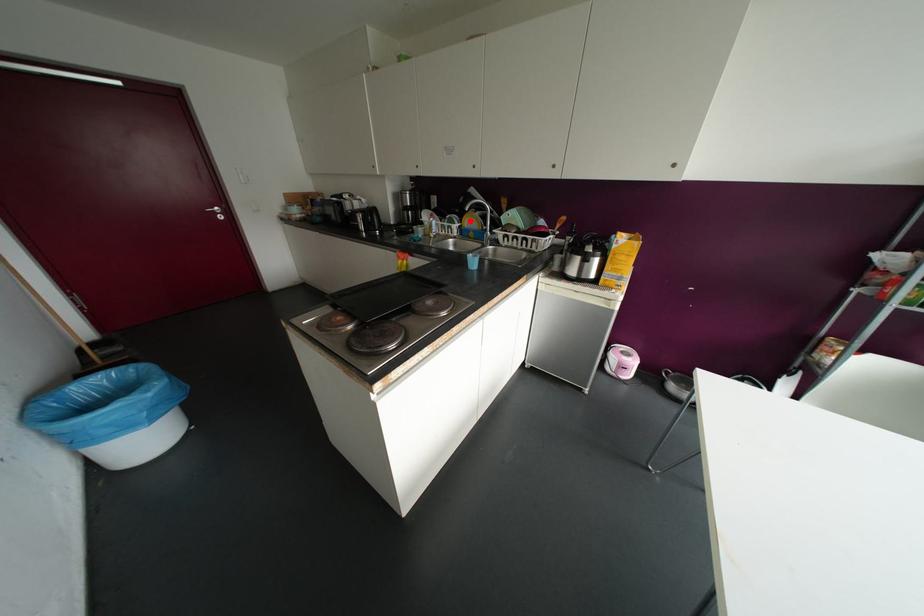
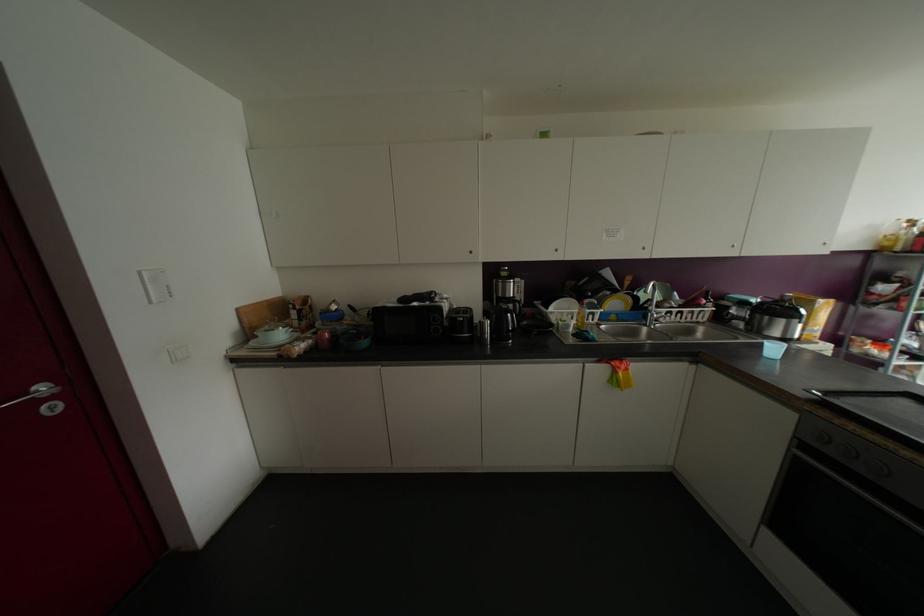
In the second image, find the point that corresponds to the highlighted location in the first image.

(614, 302)